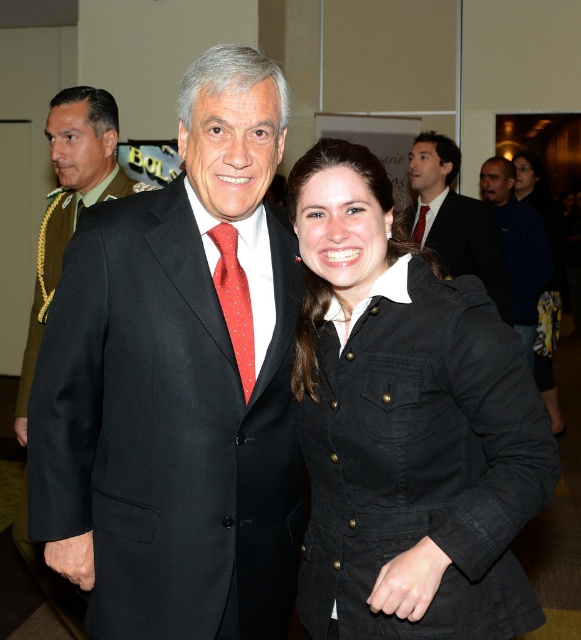
Based on the scene description, what object is located at the coordinates point (70,202)?

The point (70,202) corresponds to the matte black suit at center.

From the picture: You are a photographer at the event and need to adjust the lighting so that both the matte black suit at center and the red silk tie at center are equally visible. Given their sizes, which one might require more adjustment to ensure visibility?

The matte black suit at center is taller than the red silk tie at center. Since the matte black suit is larger in size, it might require more adjustment to ensure proper visibility compared to the smaller red silk tie at center.